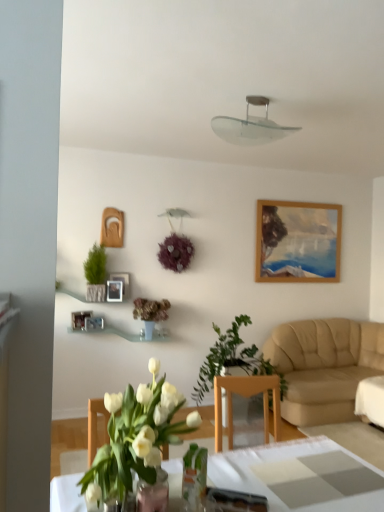
Question: From the image's perspective, is wooden photo frame at upper left, the first picture frame in the right-to-left sequence, located above or below wooden photo frame at upper left, arranged as the third picture frame when viewed from the right?

Choices:
 (A) below
 (B) above

Answer: (B)

Question: From their relative heights in the image, would you say wooden photo frame at upper left, the first picture frame in the right-to-left sequence, is taller or shorter than wooden photo frame at upper left, which is the 1th picture frame from left to right?

Choices:
 (A) tall
 (B) short

Answer: (A)

Question: Which object is the closest to the beige leather couch at right?

Choices:
 (A) translucent glass vase at center, which is counted as the 1th houseplant, starting from the back
 (B) green leafy plant at center, which ranks as the 4th houseplant in left-to-right order
 (C) clear glass vase at center
 (D) wooden photo frame at upper center, the second picture frame when ordered from left to right
 (E) wooden photo frame at upper left, the first picture frame in the right-to-left sequence

Answer: (B)

Question: Estimate the real-world distances between objects in this image. Which object is farther from the clear glass lampshade at upper center?

Choices:
 (A) clear glass vase at center
 (B) beige leather couch at right
 (C) wooden photo frame at upper center, the second picture frame when ordered from left to right
 (D) wooden photo frame at upper left, arranged as the third picture frame when viewed from the right
 (E) wooden photo frame at upper left, the first picture frame in the right-to-left sequence

Answer: (A)